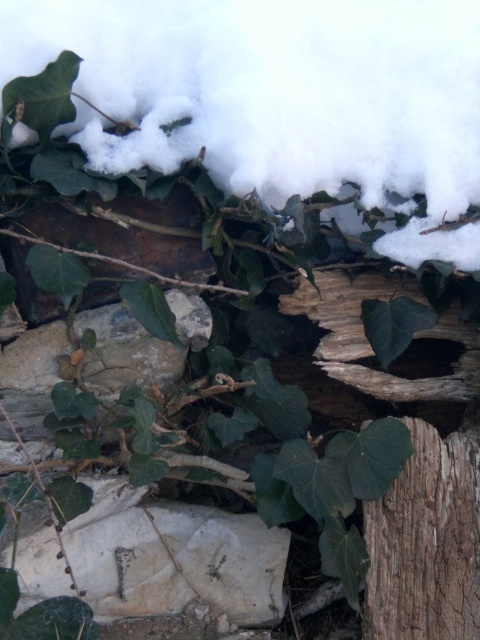
Is white fluffy snow at upper center wider than smooth brown wood at center?

Yes, white fluffy snow at upper center is wider than smooth brown wood at center.

Does white fluffy snow at upper center have a lesser height compared to smooth brown wood at center?

No, white fluffy snow at upper center is not shorter than smooth brown wood at center.

Is point (406, 140) more distant than point (432, 476)?

No, (406, 140) is closer to viewer.

Identify the location of white fluffy snow at upper center. (278, 97).